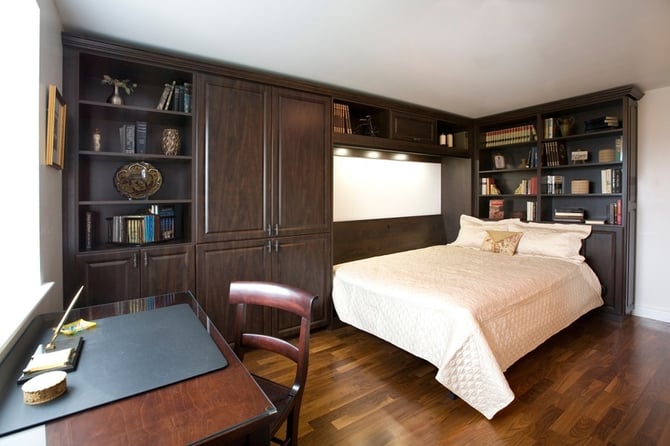
Locate an element on the screen. This screenshot has height=446, width=670. desk mat is located at coordinates tap(183, 334).